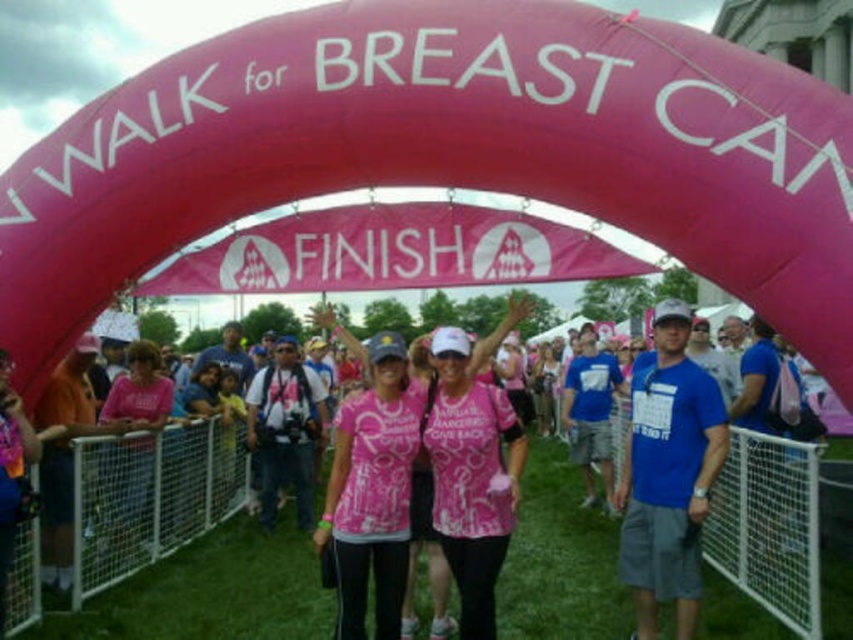
Question: Which point is farther from the camera taking this photo?

Choices:
 (A) (230, 458)
 (B) (375, 522)

Answer: (A)

Question: In this image, where is pink fabric people at center located relative to pink matte shirt at center?

Choices:
 (A) right
 (B) left

Answer: (A)

Question: Which object is farther from the camera taking this photo?

Choices:
 (A) pink matte shirt at center
 (B) pink fabric people at center

Answer: (A)

Question: Is pink fabric people at center above pink matte shirt at center?

Choices:
 (A) no
 (B) yes

Answer: (A)

Question: Does pink fabric people at center have a smaller size compared to pink matte shirt at center?

Choices:
 (A) no
 (B) yes

Answer: (A)

Question: Which point is closer to the camera taking this photo?

Choices:
 (A) (373, 564)
 (B) (270, 548)

Answer: (A)